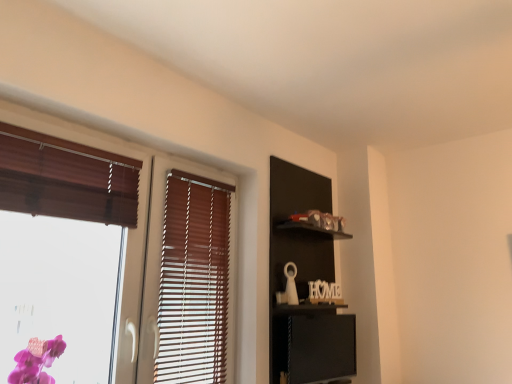
Question: Is wooden blinds at left wider than black matte shelf at upper right?

Choices:
 (A) no
 (B) yes

Answer: (A)

Question: Can black matte shelf at upper right be found inside wooden blinds at left?

Choices:
 (A) yes
 (B) no

Answer: (B)

Question: Can you confirm if wooden blinds at left is thinner than black matte shelf at upper right?

Choices:
 (A) yes
 (B) no

Answer: (A)

Question: Could you tell me if wooden blinds at left is turned towards black matte shelf at upper right?

Choices:
 (A) no
 (B) yes

Answer: (A)

Question: Is wooden blinds at left facing away from black matte shelf at upper right?

Choices:
 (A) yes
 (B) no

Answer: (B)

Question: Is wooden blinds at left at the right side of black matte shelf at upper right?

Choices:
 (A) no
 (B) yes

Answer: (A)

Question: From a real-world perspective, does black matte shelf at upper right stand above wooden blinds at left?

Choices:
 (A) yes
 (B) no

Answer: (B)

Question: Considering the relative sizes of black matte shelf at upper right and wooden blinds at left in the image provided, is black matte shelf at upper right thinner than wooden blinds at left?

Choices:
 (A) no
 (B) yes

Answer: (A)

Question: Is black matte shelf at upper right not within wooden blinds at left?

Choices:
 (A) no
 (B) yes

Answer: (B)

Question: Could you tell me if black matte shelf at upper right is turned towards wooden blinds at left?

Choices:
 (A) yes
 (B) no

Answer: (B)

Question: Are black matte shelf at upper right and wooden blinds at left making contact?

Choices:
 (A) yes
 (B) no

Answer: (B)

Question: Is wooden blinds at left at the back of black matte shelf at upper right?

Choices:
 (A) no
 (B) yes

Answer: (A)

Question: In terms of size, does black matte shelf at upper right appear bigger or smaller than wooden blinds at left?

Choices:
 (A) small
 (B) big

Answer: (B)